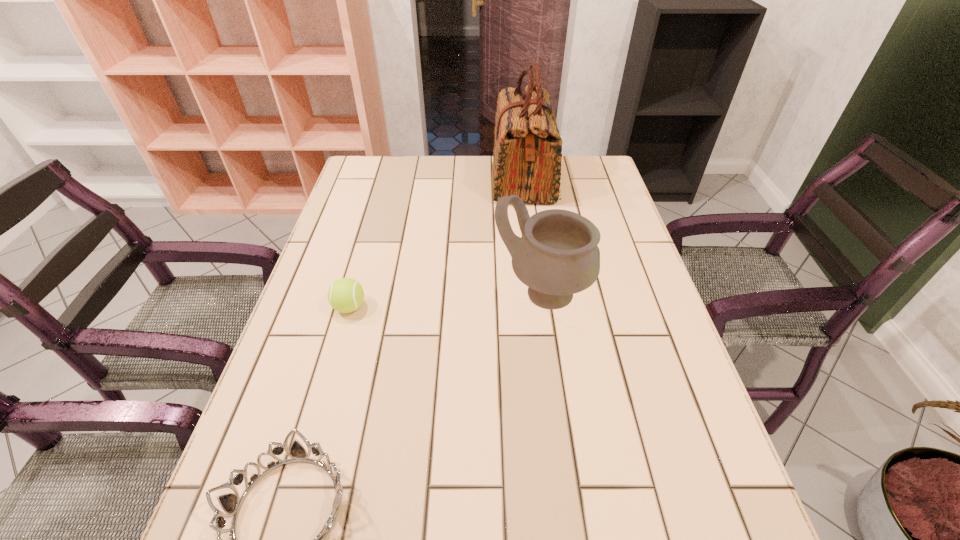
The width and height of the screenshot is (960, 540). I want to click on the tallest object, so click(527, 156).

Where is `the farthest object`? The width and height of the screenshot is (960, 540). the farthest object is located at coordinates (527, 156).

Where is `the third shortest object`? The height and width of the screenshot is (540, 960). the third shortest object is located at coordinates (557, 256).

I want to click on tennis ball, so click(345, 295).

This screenshot has width=960, height=540. In order to click on free space located on the open handle side of the shopping bag in this screenshot , I will do `click(470, 179)`.

Image resolution: width=960 pixels, height=540 pixels. I want to click on free space located on the open handle side of the shopping bag, so coord(474,179).

Where is `free space located on the open handle side of the shopping bag`? The image size is (960, 540). free space located on the open handle side of the shopping bag is located at coordinates [470, 179].

This screenshot has width=960, height=540. In order to click on free location located 0.150m on the right of the pottery in this screenshot , I will do `click(653, 293)`.

The image size is (960, 540). Identify the location of blank space located on the right of the tennis ball. (486, 307).

Locate an element on the screen. This screenshot has height=540, width=960. object that is at the far edge is located at coordinates (527, 156).